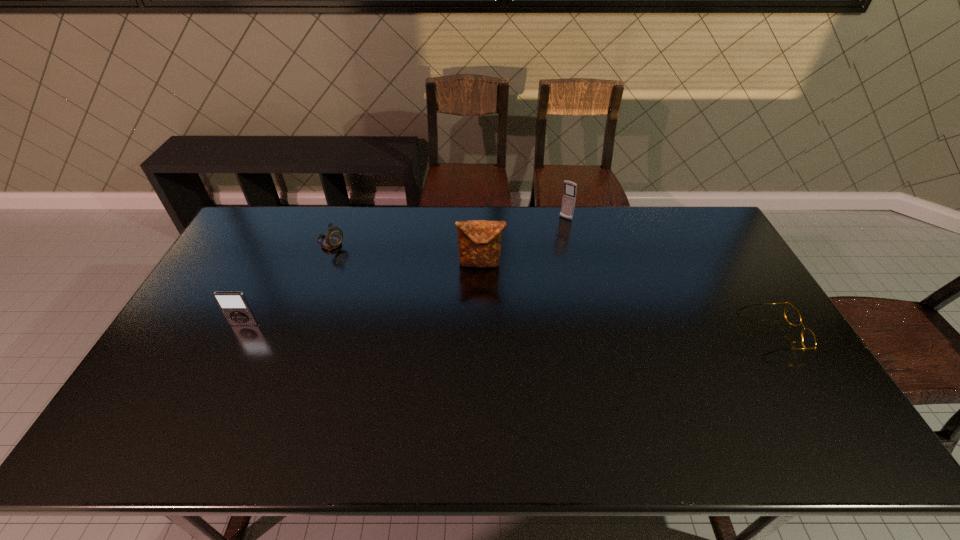
The width and height of the screenshot is (960, 540). Identify the location of vacant space situated 0.130m on the front-facing side of the third shortest object. (226, 363).

Find the location of a particular element. vacant space located 0.370m on the front-facing side of the farthest object is located at coordinates (516, 280).

At what (x,y) coordinates should I click in order to perform the action: click on vacant area situated 0.240m on the front-facing side of the farthest object. Please return your answer as a coordinate pair (x, y). Image resolution: width=960 pixels, height=540 pixels. Looking at the image, I should click on (534, 258).

Identify the location of vacant space located on the front-facing side of the farthest object. (530, 262).

Find the location of a particular element. The width and height of the screenshot is (960, 540). free location located 0.110m on the open side of the third nearest object is located at coordinates (474, 295).

The image size is (960, 540). Find the location of `free location located on the open side of the third nearest object`. free location located on the open side of the third nearest object is located at coordinates (475, 286).

The height and width of the screenshot is (540, 960). What are the coordinates of `free space located 0.380m on the open side of the third nearest object` in the screenshot? It's located at (462, 368).

You are a GUI agent. You are given a task and a screenshot of the screen. Output one action in this format:
    pyautogui.click(x=<x>, y=<y>)
    Task: Click on the vacant space located on the face of the second farthest object
    Image resolution: width=960 pixels, height=540 pixels.
    Given the screenshot: What is the action you would take?
    pyautogui.click(x=369, y=266)

You are a GUI agent. You are given a task and a screenshot of the screen. Output one action in this format:
    pyautogui.click(x=<x>, y=<y>)
    Task: Click on the free space located on the face of the second farthest object
    
    Given the screenshot: What is the action you would take?
    pyautogui.click(x=371, y=267)

Locate an element on the screen. The width and height of the screenshot is (960, 540). vacant region located on the face of the second farthest object is located at coordinates (360, 261).